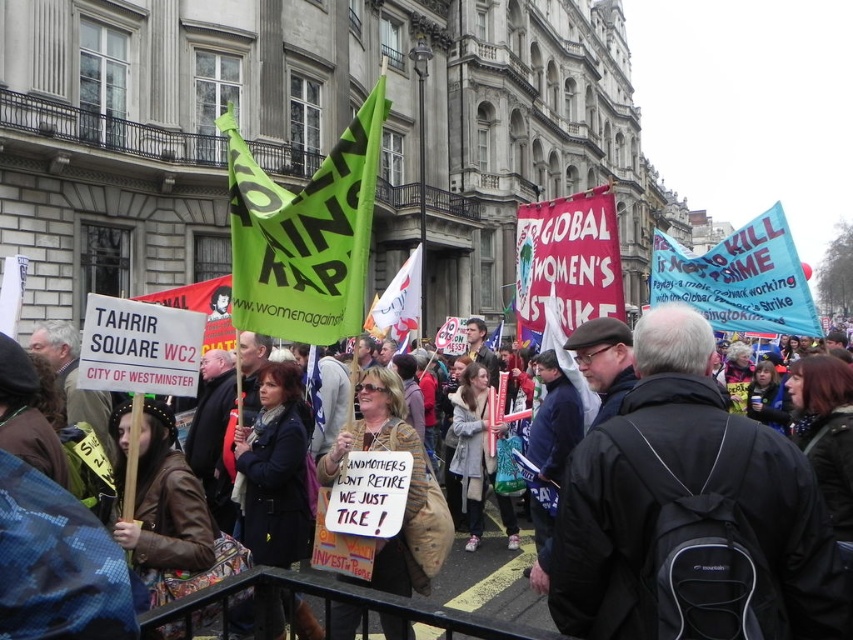
You are a photographer trying to capture the protest scene. You want to ensure both the blue fabric banner at upper right and the red fabric banner at center are clearly visible in your shot. Given their sizes, which banner might require you to adjust your camera angle to avoid it being too dominant in the frame?

The blue fabric banner at upper right has a larger width than the red fabric banner at center, so it might require adjusting the camera angle to prevent it from dominating the frame.

You are a photographer standing at the front of the protest. You want to take a photo that includes both the red fabric banner at center and the leather jacket at center. Which object should you position closer to the camera to ensure both are in frame?

The red fabric banner at center is located above the leather jacket at center. To include both in the frame, position the camera so that the leather jacket at center is closer to the camera, as the banner is above it and might be out of frame if the jacket is too close.